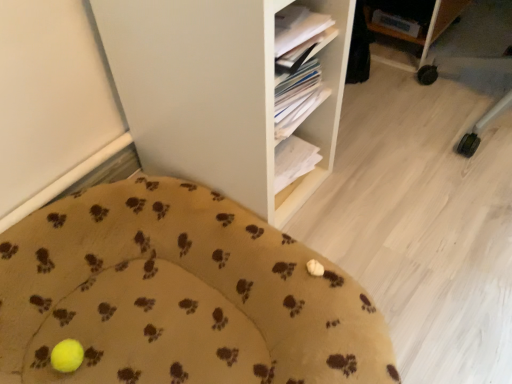
What do you see at coordinates (179, 295) in the screenshot? I see `yellow fabric cushion at lower left` at bounding box center [179, 295].

Where is `yellow fabric cushion at lower left`? This screenshot has width=512, height=384. yellow fabric cushion at lower left is located at coordinates (179, 295).

In order to face yellow fabric cushion at lower left, should I rotate leftwards or rightwards?

To face it directly, rotate left by 9.492 degrees.

You are a GUI agent. You are given a task and a screenshot of the screen. Output one action in this format:
    pyautogui.click(x=<x>, y=<y>)
    Task: Click on the white matte shelf at center
    The height and width of the screenshot is (384, 512).
    Given the screenshot: What is the action you would take?
    pyautogui.click(x=216, y=91)

Describe the element at coordinates (216, 91) in the screenshot. This screenshot has height=384, width=512. I see `white matte shelf at center` at that location.

The image size is (512, 384). What are the coordinates of `yellow fabric cushion at lower left` in the screenshot? It's located at (179, 295).

Is white matte shelf at center to the right of yellow fabric cushion at lower left from the viewer's perspective?

Correct, you'll find white matte shelf at center to the right of yellow fabric cushion at lower left.

Is white matte shelf at center closer to the viewer compared to yellow fabric cushion at lower left?

That is False.

Between point (161, 11) and point (120, 266), which one is positioned in front?

Positioned in front is point (161, 11).

From the image's perspective, which one is positioned higher, white matte shelf at center or yellow fabric cushion at lower left?

white matte shelf at center is shown above in the image.

From a real-world perspective, is white matte shelf at center positioned under yellow fabric cushion at lower left based on gravity?

Incorrect, from a real-world perspective, white matte shelf at center is higher than yellow fabric cushion at lower left.

Between white matte shelf at center and yellow fabric cushion at lower left, which one has larger width?

With larger width is yellow fabric cushion at lower left.

Between white matte shelf at center and yellow fabric cushion at lower left, which one has more height?

white matte shelf at center.

Based on their sizes in the image, would you say white matte shelf at center is bigger or smaller than yellow fabric cushion at lower left?

In the image, white matte shelf at center appears to be larger than yellow fabric cushion at lower left.

Is white matte shelf at center spatially inside yellow fabric cushion at lower left, or outside of it?

white matte shelf at center is spatially situated outside yellow fabric cushion at lower left.

In the scene shown: Are white matte shelf at center and yellow fabric cushion at lower left far apart?

They are positioned close to each other.

Is white matte shelf at center looking in the opposite direction of yellow fabric cushion at lower left?

No, white matte shelf at center's orientation is not away from yellow fabric cushion at lower left.

How much distance is there between white matte shelf at center and yellow fabric cushion at lower left?

white matte shelf at center is 11.55 inches away from yellow fabric cushion at lower left.

The height and width of the screenshot is (384, 512). In order to click on furniture beneath the white matte shelf at center (from a real-world perspective) in this screenshot , I will do `click(179, 295)`.

Considering the positions of objects yellow fabric cushion at lower left and white matte shelf at center in the image provided, who is more to the left, yellow fabric cushion at lower left or white matte shelf at center?

From the viewer's perspective, yellow fabric cushion at lower left appears more on the left side.

Is the position of yellow fabric cushion at lower left more distant than that of white matte shelf at center?

No, yellow fabric cushion at lower left is in front of white matte shelf at center.

Is point (72, 231) closer to camera compared to point (95, 19)?

No, (72, 231) is further to viewer.

From the image's perspective, is yellow fabric cushion at lower left on white matte shelf at center?

No, from the image's perspective, yellow fabric cushion at lower left is not above white matte shelf at center.

From a real-world perspective, which object stands above the other?

white matte shelf at center.

Between yellow fabric cushion at lower left and white matte shelf at center, which one has smaller width?

white matte shelf at center.

Is yellow fabric cushion at lower left shorter than white matte shelf at center?

Indeed, yellow fabric cushion at lower left has a lesser height compared to white matte shelf at center.

Does yellow fabric cushion at lower left have a larger size compared to white matte shelf at center?

Incorrect, yellow fabric cushion at lower left is not larger than white matte shelf at center.

Which is correct: yellow fabric cushion at lower left is inside white matte shelf at center, or outside of it?

yellow fabric cushion at lower left is not enclosed by white matte shelf at center.

Consider the image. Are yellow fabric cushion at lower left and white matte shelf at center making contact?

No, yellow fabric cushion at lower left is not touching white matte shelf at center.

Is yellow fabric cushion at lower left facing away from white matte shelf at center?

No.

Identify the location of shelf on the right of yellow fabric cushion at lower left. (216, 91).

In order to click on shelf above the yellow fabric cushion at lower left (from the image's perspective) in this screenshot , I will do `click(216, 91)`.

Locate an element on the screen. This screenshot has height=384, width=512. furniture below the white matte shelf at center (from the image's perspective) is located at coordinates (179, 295).